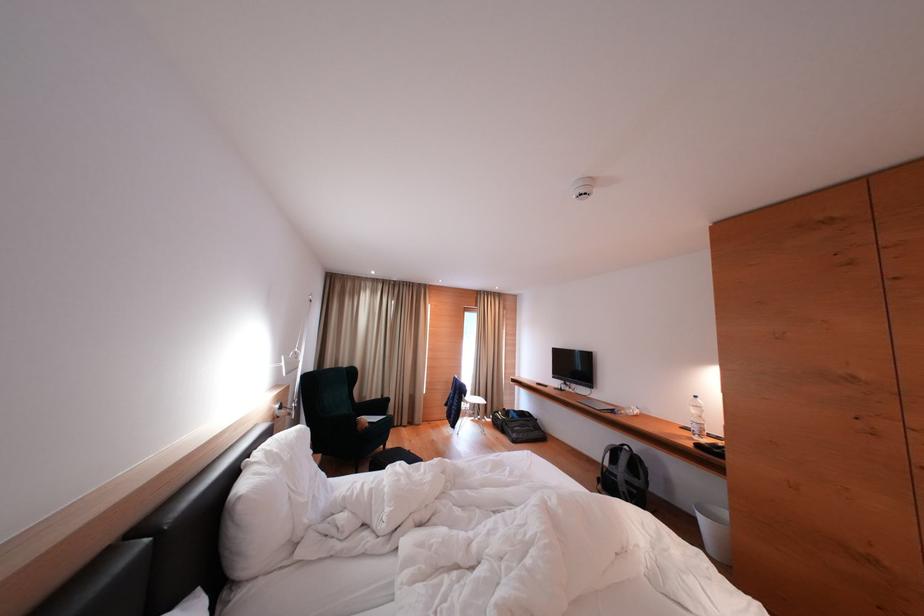
The width and height of the screenshot is (924, 616). What do you see at coordinates (711, 448) in the screenshot?
I see `the black remote control` at bounding box center [711, 448].